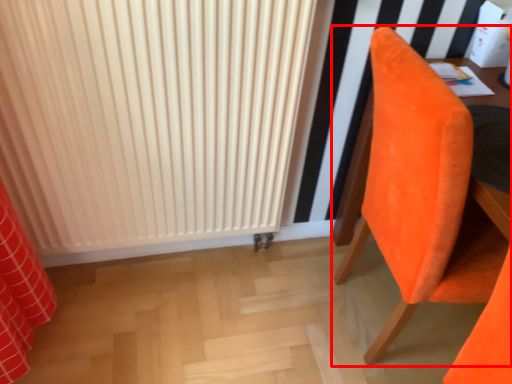
Question: From the image's perspective, considering the relative positions of chair (annotated by the red box) and radiator in the image provided, where is chair (annotated by the red box) located with respect to the staircase?

Choices:
 (A) above
 (B) below

Answer: (B)